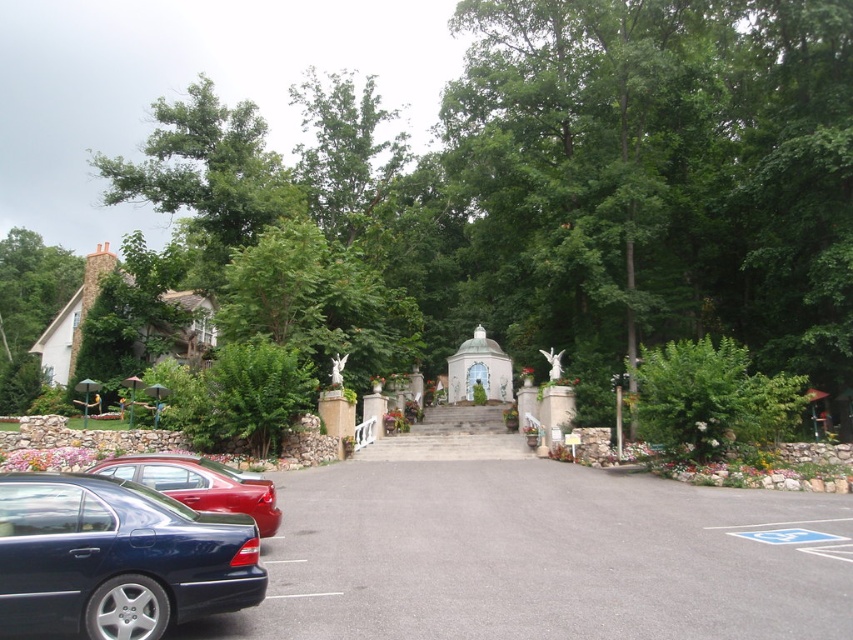
Who is more distant from viewer, [665,83] or [177,545]?

Point [665,83]

Is green leafy tree at center to the left of shiny blue sedan at lower left from the viewer's perspective?

Correct, you'll find green leafy tree at center to the left of shiny blue sedan at lower left.

Is point (772, 280) closer to viewer compared to point (161, 493)?

No, it is not.

I want to click on green leafy tree at center, so click(585, 180).

Looking at this image, is green leafy tree at center to the left of white stone steps at center from the viewer's perspective?

Indeed, green leafy tree at center is positioned on the left side of white stone steps at center.

Which is behind, point (340, 176) or point (445, 428)?

Positioned behind is point (340, 176).

Find the location of a particular element. This screenshot has height=640, width=853. green leafy tree at center is located at coordinates (585, 180).

Based on the photo, who is higher up, green leafy tree at center or green leafy tree at upper left?

Positioned higher is green leafy tree at center.

What do you see at coordinates (585, 180) in the screenshot?
I see `green leafy tree at center` at bounding box center [585, 180].

The height and width of the screenshot is (640, 853). I want to click on green leafy tree at center, so click(585, 180).